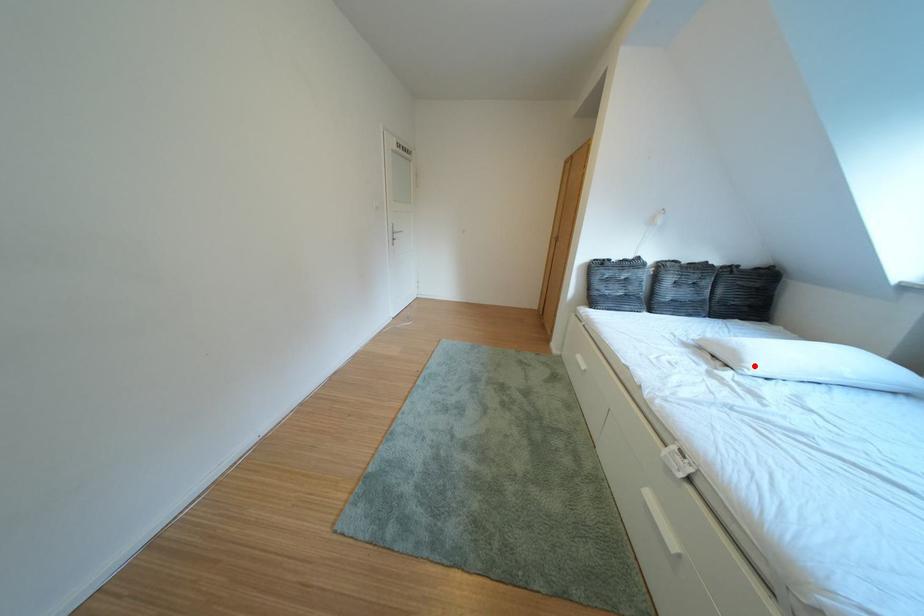
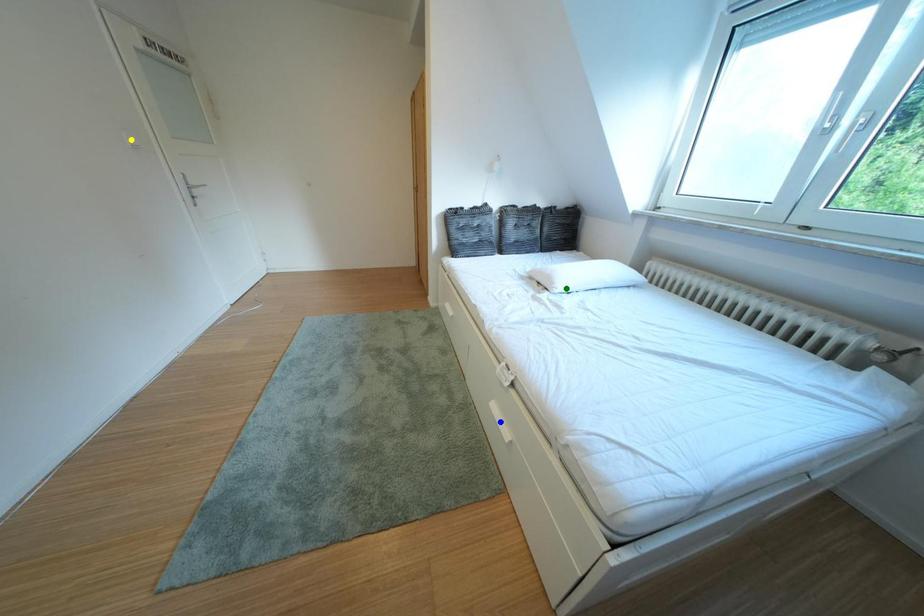
Question: I am providing you with two images of the same scene from different viewpoints. A red point is marked on the first image. You are given multiple points on the second image. Which point in image 2 represents the same 3d spot as the red point in image 1?

Choices:
 (A) yellow point
 (B) blue point
 (C) green point

Answer: (C)